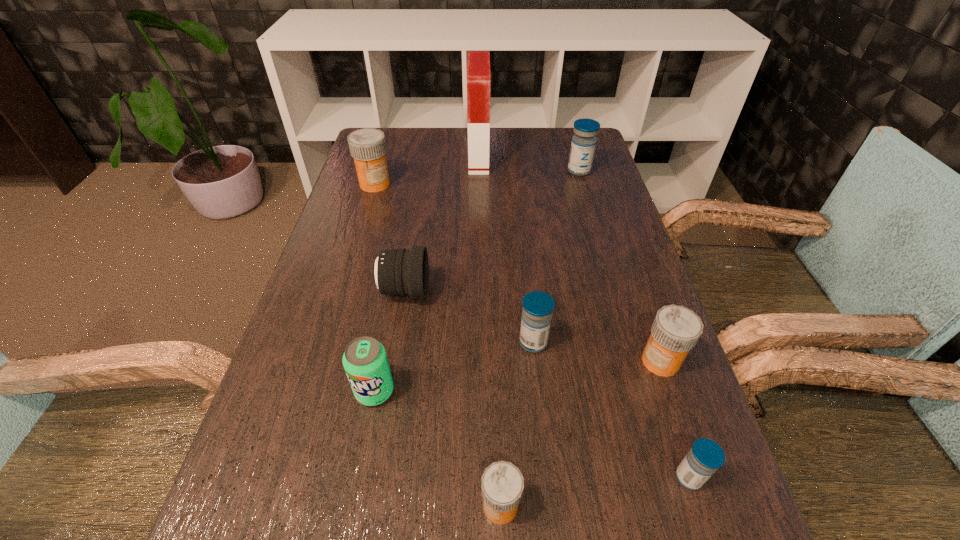
You are a GUI agent. You are given a task and a screenshot of the screen. Output one action in this format:
    pyautogui.click(x=<x>, y=<y>)
    Task: Click on the tallest object
    
    Given the screenshot: What is the action you would take?
    pyautogui.click(x=478, y=64)

This screenshot has width=960, height=540. I want to click on red cigarette_case, so click(478, 64).

At what (x,y) coordinates should I click in order to perform the action: click on the farthest blue medicine. Please return your answer as a coordinate pair (x, y). The height and width of the screenshot is (540, 960). Looking at the image, I should click on (583, 144).

Locate an element on the screen. the farthest orange medicine is located at coordinates (367, 146).

Image resolution: width=960 pixels, height=540 pixels. I want to click on the leftmost orange medicine, so click(x=367, y=146).

At what (x,y) coordinates should I click in order to perform the action: click on pop soda. Please return your answer as a coordinate pair (x, y). Looking at the image, I should click on (365, 361).

Identify the location of the second smallest blue medicine. This screenshot has height=540, width=960. (538, 306).

At what (x,y) coordinates should I click in order to perform the action: click on the sixth object from left to right. Please return your answer as a coordinate pair (x, y). Looking at the image, I should click on (538, 306).

Locate an element on the screen. the second smallest orange medicine is located at coordinates (x=676, y=329).

This screenshot has height=540, width=960. Identify the location of the second nearest orange medicine. (676, 329).